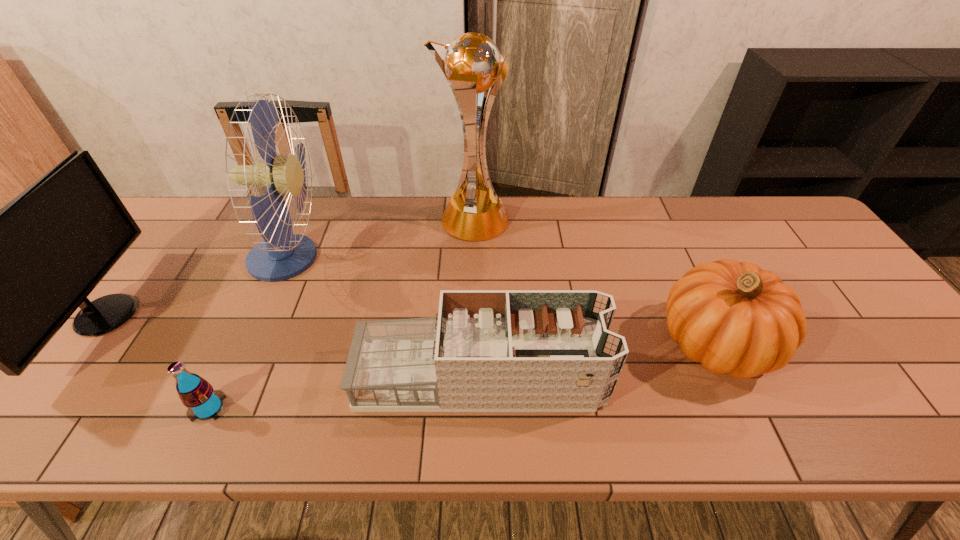
This screenshot has height=540, width=960. In order to click on trophy in this screenshot , I will do `click(472, 64)`.

Where is `the fifth shortest object`? This screenshot has height=540, width=960. the fifth shortest object is located at coordinates (282, 255).

In order to click on the leftmost object in this screenshot , I will do `click(0, 283)`.

Locate an element on the screen. This screenshot has height=540, width=960. computer monitor is located at coordinates (0, 283).

Locate an element on the screen. pumpkin is located at coordinates (734, 318).

Locate an element on the screen. The image size is (960, 540). the rightmost object is located at coordinates (734, 318).

You are a GUI agent. You are given a task and a screenshot of the screen. Output one action in this format:
    pyautogui.click(x=<x>, y=<y>)
    Task: Click on the second shortest object
    Image resolution: width=960 pixels, height=540 pixels.
    Given the screenshot: What is the action you would take?
    pyautogui.click(x=486, y=350)

In order to click on the shortest object in this screenshot , I will do `click(203, 402)`.

At what (x,y) coordinates should I click in order to perform the action: click on vacant space located on the front-facing side of the trophy. Please return your answer as a coordinate pair (x, y). The image size is (960, 540). Looking at the image, I should click on (559, 221).

The height and width of the screenshot is (540, 960). In order to click on vacant area located 0.070m at the front of the second tallest object where the blades are visible in this screenshot , I will do `click(350, 258)`.